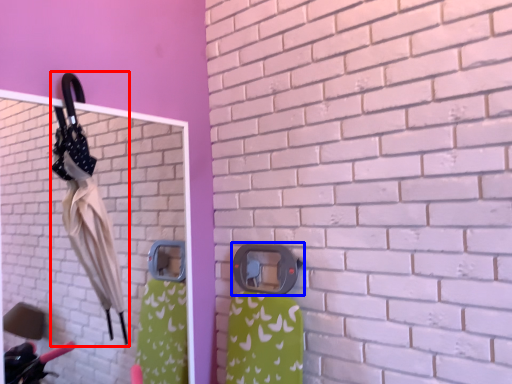
Question: Which of the following is the farthest to the observer, umbrella (highlighted by a red box) or door handle (highlighted by a blue box)?

Choices:
 (A) umbrella
 (B) door handle

Answer: (B)